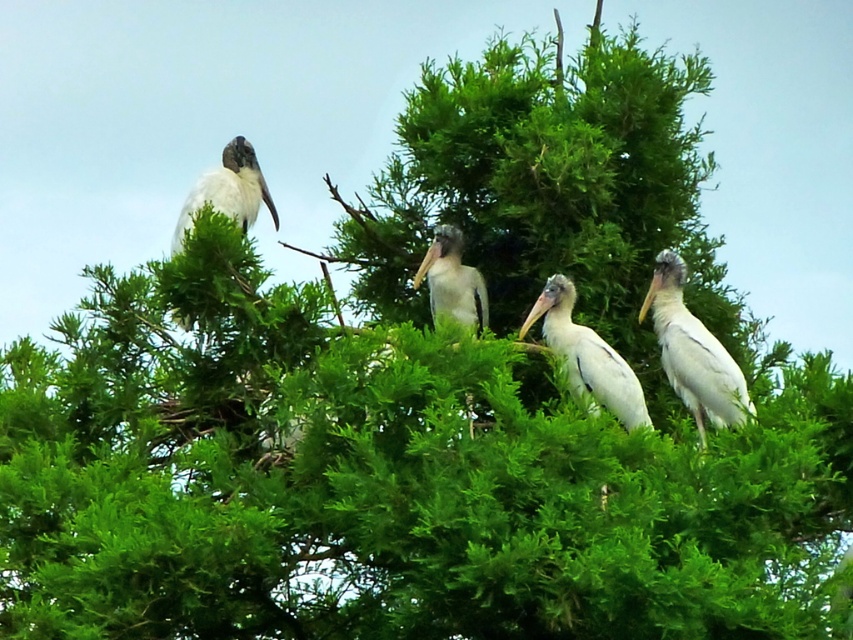
You are a small bird flying towards the tree. You want to land on the nearest stork. Which stork should you choose between the white matte stork at upper right and the white matte stork at upper left?

The distance between the white matte stork at upper right and the white matte stork at upper left is 9.06 feet. Since you are flying towards the tree, you would need to choose the stork that is closer to your current position. However, without knowing your exact location, it is impossible to determine which stork is nearer to you. Please provide your current position relative to the tree to get a precise answer.

You are standing at the camera position and want to take a photo of the birds. The camera has a focal length of 50mm. What is the approximate distance in meters between you and the birds located at point (245, 218)?

The distance between the camera and the birds at point (245, 218) is 8.50 meters.

You are a birdwatcher observing the white matte stork at center and the white matte stork at upper left. Which stork is positioned lower in the tree?

The white matte stork at center is positioned lower in the tree than the white matte stork at upper left.